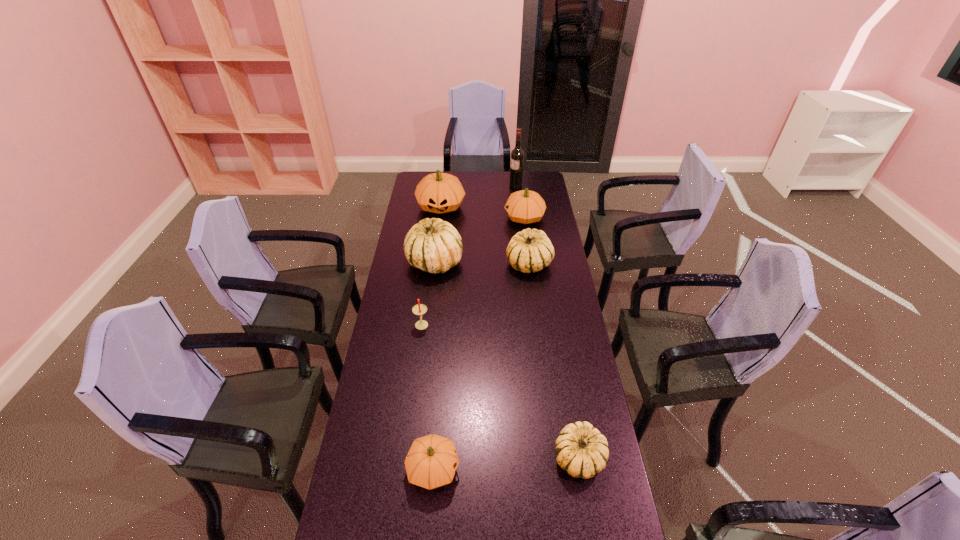
I want to click on wine bottle, so click(x=517, y=154).

Where is `the farthest object`? The image size is (960, 540). the farthest object is located at coordinates (517, 154).

Find the location of `the biggest orange gourd`. the biggest orange gourd is located at coordinates (439, 193).

Find the location of `the leftmost white gourd`. the leftmost white gourd is located at coordinates (433, 245).

At what (x,y) coordinates should I click in order to perform the action: click on the rightmost orange gourd. Please return your answer as a coordinate pair (x, y). The height and width of the screenshot is (540, 960). Looking at the image, I should click on 525,206.

I want to click on the second smallest white gourd, so click(x=528, y=251).

This screenshot has height=540, width=960. In order to click on the third nearest object in this screenshot , I will do `click(419, 309)`.

At what (x,y) coordinates should I click in order to perform the action: click on the smallest orange gourd. Please return your answer as a coordinate pair (x, y). The image size is (960, 540). Looking at the image, I should click on (432, 460).

Find the location of a particular element. The width and height of the screenshot is (960, 540). the smallest white gourd is located at coordinates (581, 450).

Where is `vacant position located on the front and back of the wine bottle`? The image size is (960, 540). vacant position located on the front and back of the wine bottle is located at coordinates (487, 186).